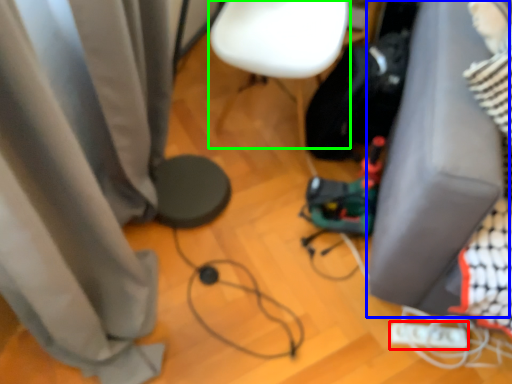
Question: Estimate the real-world distances between objects in this image. Which object is farther from Wii controller (highlighted by a red box), furniture (highlighted by a blue box) or armchair (highlighted by a green box)?

Choices:
 (A) furniture
 (B) armchair

Answer: (B)